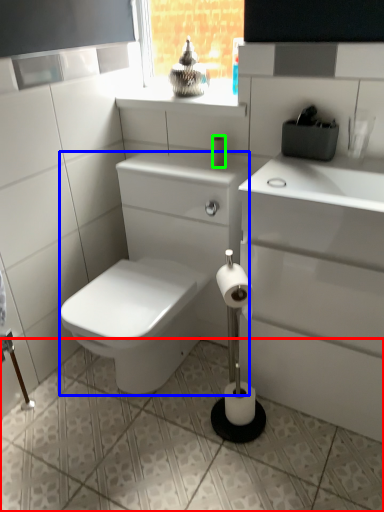
Question: Considering the real-world distances, which object is closest to ceramic tile (highlighted by a red box)? porcelain (highlighted by a blue box) or toilet paper (highlighted by a green box).

Choices:
 (A) porcelain
 (B) toilet paper

Answer: (A)